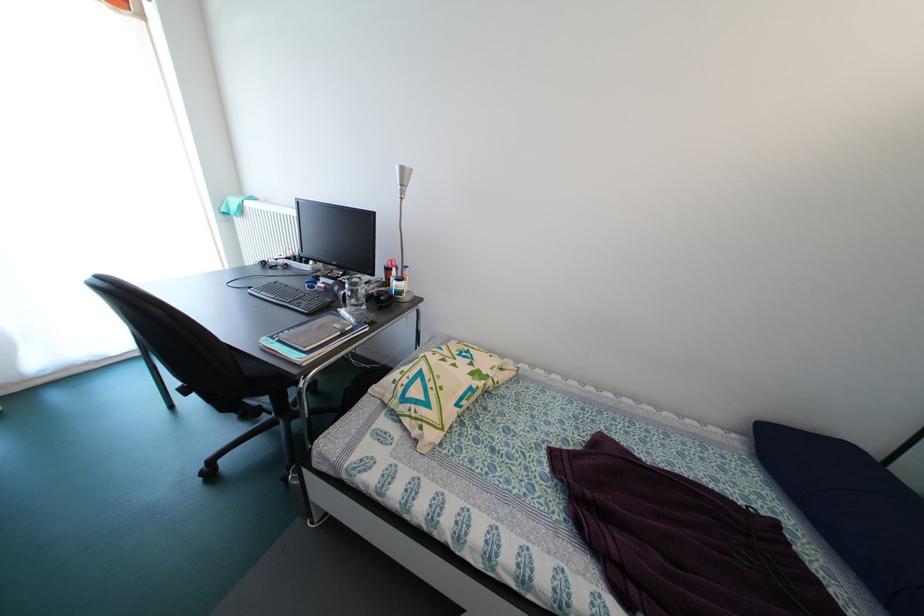
Locate an element on the screen. metal water bottle is located at coordinates (357, 300).